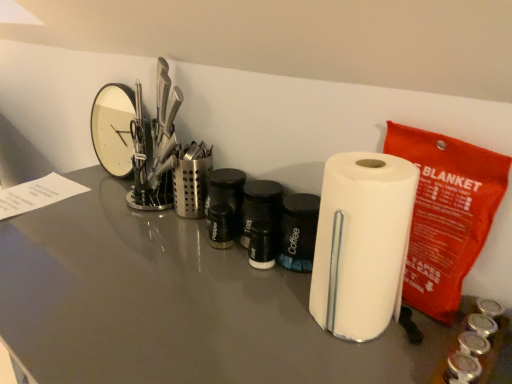
The width and height of the screenshot is (512, 384). What are the coordinates of `free space in front of white paper towel at right, arranged as the first stationery when viewed from the right` in the screenshot? It's located at (413, 348).